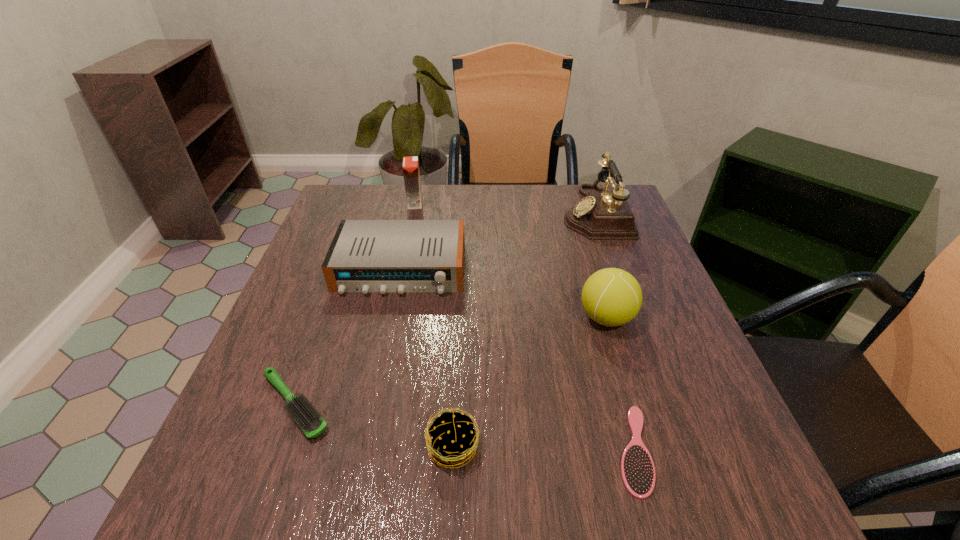
Where is `vacant space at the near edge of the desktop`? This screenshot has width=960, height=540. vacant space at the near edge of the desktop is located at coordinates (438, 503).

Identify the location of free point at the left edge. Image resolution: width=960 pixels, height=540 pixels. (323, 285).

Find the location of a particular element. free space at the right edge is located at coordinates (652, 288).

The image size is (960, 540). In the image, there is a desktop. Find the location of `free space at the far left corner`. free space at the far left corner is located at coordinates (392, 195).

This screenshot has width=960, height=540. I want to click on free region at the near left corner, so click(x=263, y=500).

Image resolution: width=960 pixels, height=540 pixels. Find the location of `free space between the shortest object and the telephone`. free space between the shortest object and the telephone is located at coordinates (614, 331).

Image resolution: width=960 pixels, height=540 pixels. I want to click on blank region between the tallest object and the shortest object, so click(x=614, y=331).

At what (x,y) coordinates should I click in order to perform the action: click on free point between the patty and the orange juice. Please return your answer as a coordinate pair (x, y). This screenshot has width=960, height=540. Looking at the image, I should click on (434, 325).

Locate an element on the screen. The image size is (960, 540). unoccupied area between the taller hairbrush and the fifth nearest object is located at coordinates (348, 337).

Find the location of `free space between the fourth farthest object and the patty`. free space between the fourth farthest object and the patty is located at coordinates (530, 382).